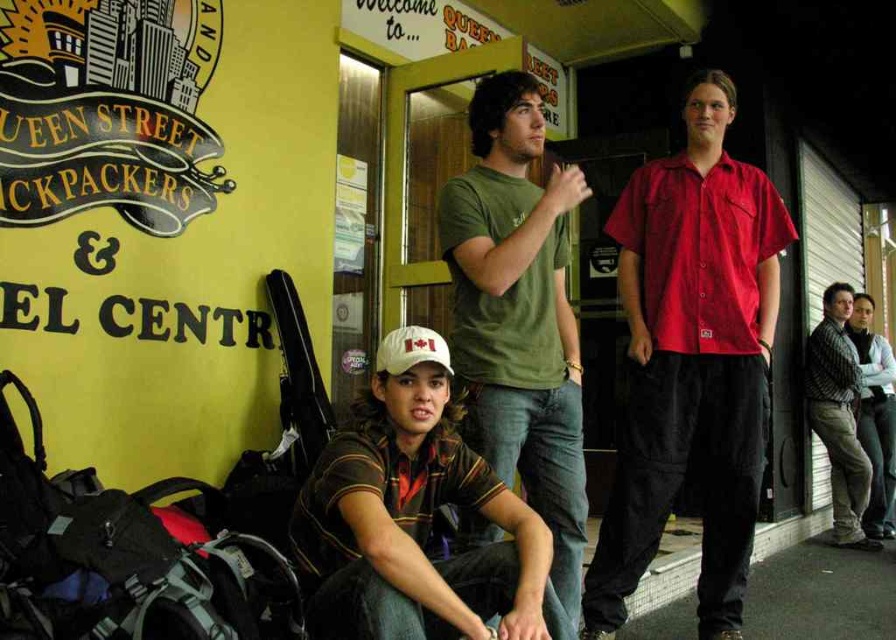
You are a photographer wanting to capture both the striped shirt at right and the white fabric baseball cap at center in a single frame. Given their sizes, which object should you focus on to ensure both fit clearly in the photo?

The striped shirt at right is wider than the white fabric baseball cap at center, so focusing on the striped shirt at right would allow both objects to fit clearly in the photo since it takes up more space.